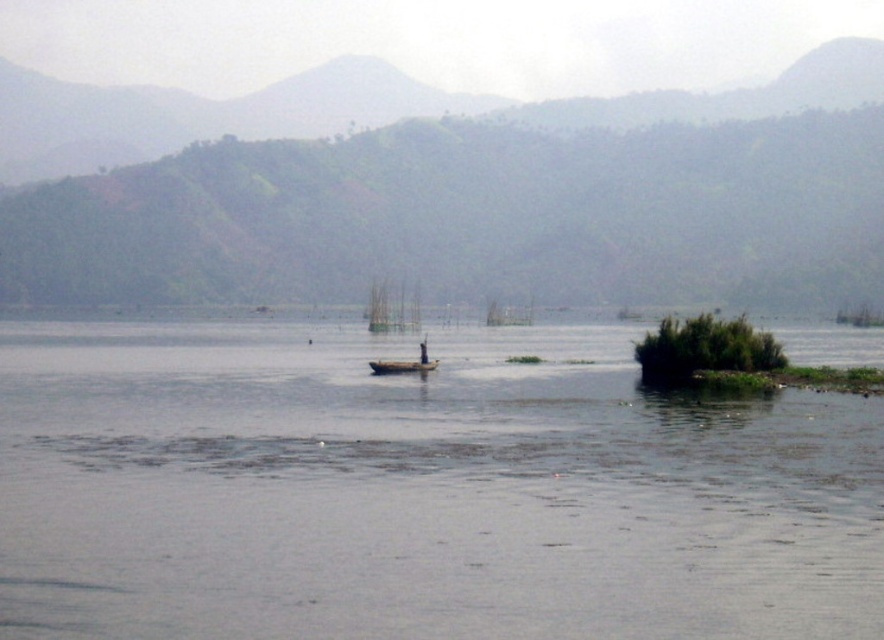
Question: Which is farther from the clear water at center?

Choices:
 (A) green grassy hill at center
 (B) wooden canoe at center

Answer: (A)

Question: Is clear water at center wider than wooden canoe at center?

Choices:
 (A) yes
 (B) no

Answer: (A)

Question: Is clear water at center below wooden boat at center?

Choices:
 (A) yes
 (B) no

Answer: (A)

Question: Estimate the real-world distances between objects in this image. Which object is farther from the wooden canoe at center?

Choices:
 (A) green grassy hill at center
 (B) clear water at center

Answer: (A)

Question: Which point is closer to the camera taking this photo?

Choices:
 (A) (x=410, y=368)
 (B) (x=667, y=433)

Answer: (B)

Question: Is clear water at center positioned before wooden boat at center?

Choices:
 (A) no
 (B) yes

Answer: (B)